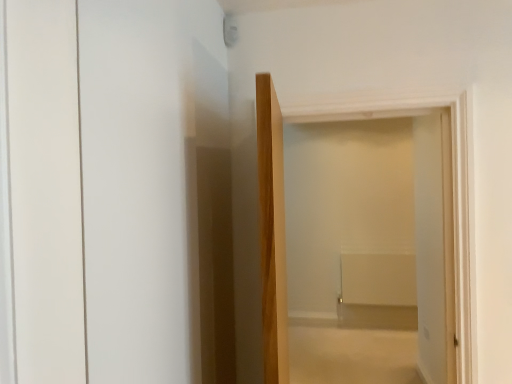
The height and width of the screenshot is (384, 512). Identify the location of white glossy door at left. (112, 183).

What do you see at coordinates (112, 183) in the screenshot? This screenshot has height=384, width=512. I see `white glossy door at left` at bounding box center [112, 183].

I want to click on white matte door at center, so point(272,231).

What do you see at coordinates (272, 231) in the screenshot? This screenshot has height=384, width=512. I see `white matte door at center` at bounding box center [272, 231].

You are a GUI agent. You are given a task and a screenshot of the screen. Output one action in this format:
    pyautogui.click(x=<x>, y=<y>)
    Task: Click on the white glossy door at left
    
    Given the screenshot: What is the action you would take?
    pyautogui.click(x=112, y=183)

Visually, is white matte door at center positioned to the left or to the right of white glossy door at left?

Based on their positions, white matte door at center is located to the right of white glossy door at left.

Does white matte door at center come in front of white glossy door at left?

No, white matte door at center is further to the viewer.

Is point (282, 257) positioned before point (50, 24)?

No.

From the image's perspective, is white matte door at center on top of white glossy door at left?

No, from the image's perspective, white matte door at center is not on top of white glossy door at left.

From a real-world perspective, is white matte door at center located higher than white glossy door at left?

No.

Which of these two, white matte door at center or white glossy door at left, is wider?

white matte door at center is wider.

Does white matte door at center have a greater height compared to white glossy door at left?

Yes, white matte door at center is taller than white glossy door at left.

Considering the relative sizes of white matte door at center and white glossy door at left in the image provided, is white matte door at center bigger than white glossy door at left?

Yes.

Is white matte door at center spatially inside white glossy door at left, or outside of it?

white matte door at center is not enclosed by white glossy door at left.

Is white matte door at center touching white glossy door at left?

No.

Could you tell me if white matte door at center is facing white glossy door at left?

No, white matte door at center is not turned towards white glossy door at left.

How many degrees apart are the facing directions of white matte door at center and white glossy door at left?

They differ by 89.5 degrees in their facing directions.

How much distance is there between white matte door at center and white glossy door at left?

15.77 inches.

The height and width of the screenshot is (384, 512). In order to click on screen door above the white matte door at center (from the image's perspective) in this screenshot , I will do `click(112, 183)`.

Considering the relative positions of white glossy door at left and white matte door at center in the image provided, is white glossy door at left to the left of white matte door at center from the viewer's perspective?

Correct, you'll find white glossy door at left to the left of white matte door at center.

Is the depth of white glossy door at left less than that of white matte door at center?

Yes.

Which point is more forward, (x=194, y=52) or (x=287, y=356)?

The point (x=194, y=52) is in front.

From the image's perspective, is white glossy door at left below white matte door at center?

Incorrect, from the image's perspective, white glossy door at left is higher than white matte door at center.

From a real-world perspective, who is located lower, white glossy door at left or white matte door at center?

From a 3D spatial view, white matte door at center is below.

Considering the relative sizes of white glossy door at left and white matte door at center in the image provided, is white glossy door at left wider than white matte door at center?

In fact, white glossy door at left might be narrower than white matte door at center.

Can you confirm if white glossy door at left is shorter than white matte door at center?

Yes.

Can you confirm if white glossy door at left is smaller than white matte door at center?

Yes.

From the picture: Do you think white glossy door at left is within white matte door at center, or outside of it?

The correct answer is: outside.

Is white glossy door at left with white matte door at center?

white glossy door at left and white matte door at center are not in contact.

Does white glossy door at left turn towards white matte door at center?

Yes, white glossy door at left is facing white matte door at center.

Where is `screen door above the white matte door at center (from the image's perspective)`? Image resolution: width=512 pixels, height=384 pixels. screen door above the white matte door at center (from the image's perspective) is located at coordinates (112, 183).

This screenshot has width=512, height=384. I want to click on screen door that appears on the left of white matte door at center, so click(112, 183).

The height and width of the screenshot is (384, 512). I want to click on screen door above the white matte door at center (from a real-world perspective), so click(112, 183).